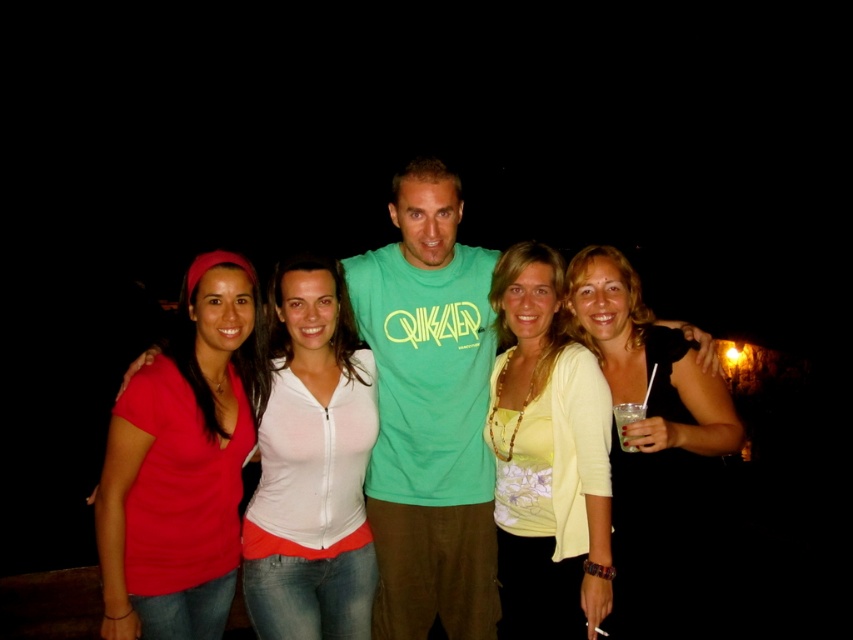
Question: Which point is farther to the camera?

Choices:
 (A) matte red shirt at center
 (B) black matte dress at right
 (C) clear plastic cup at center right

Answer: (A)

Question: Can you confirm if matte red shirt at center is positioned above green matte t-shirt at center?

Choices:
 (A) yes
 (B) no

Answer: (B)

Question: Among these objects, which one is farthest from the camera?

Choices:
 (A) black matte dress at right
 (B) green matte t-shirt at center
 (C) clear plastic cup at center right
 (D) yellow fabric top at center

Answer: (B)

Question: Does matte red shirt at center have a greater width compared to black matte dress at right?

Choices:
 (A) yes
 (B) no

Answer: (B)

Question: Which of the following is the farthest from the observer?

Choices:
 (A) (300, 545)
 (B) (624, 417)
 (C) (471, 452)
 (D) (688, 384)

Answer: (C)

Question: Can you confirm if yellow fabric top at center is bigger than black matte dress at right?

Choices:
 (A) no
 (B) yes

Answer: (A)